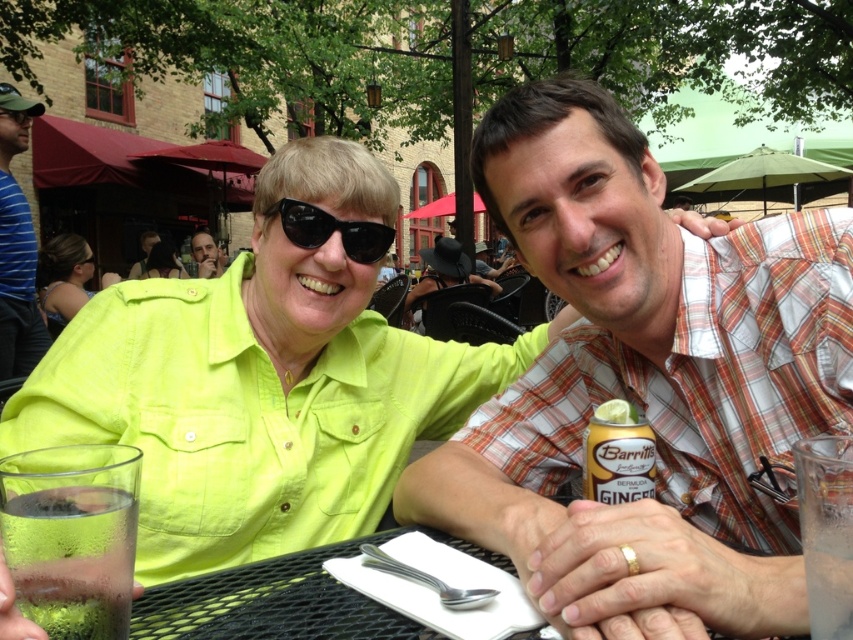
You are standing at point (x=218, y=269) and want to walk to the brick building in the background. Is the point (x=123, y=557) in your way?

Point (x=123, y=557) is in front of point (x=218, y=269), so yes, it is in your way when walking towards the brick building in the background.

You are a waiter at the outdoor cafe and need to place a small dessert plate between the clear glass at lower left and the matte black sunglasses at upper left. Can you fit it vertically between them without tilting the plate?

The clear glass at lower left is shorter than the matte black sunglasses at upper left, so the vertical space between them is sufficient to fit the dessert plate without tilting.